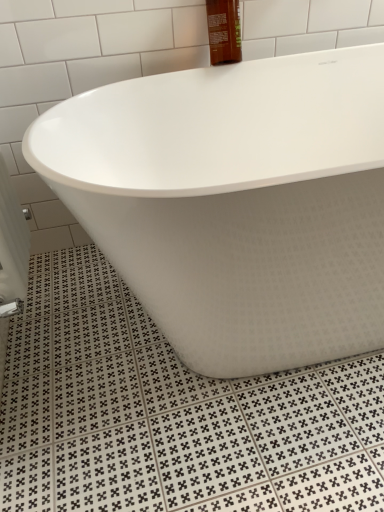
Question: From a real-world perspective, is white matte bathtub at center physically located above or below brown glass bottle at upper center?

Choices:
 (A) above
 (B) below

Answer: (B)

Question: Is point (372, 173) closer or farther from the camera than point (208, 27)?

Choices:
 (A) farther
 (B) closer

Answer: (B)

Question: Would you say white matte bathtub at center is to the left or to the right of brown glass bottle at upper center in the picture?

Choices:
 (A) left
 (B) right

Answer: (B)

Question: Considering the positions of brown glass bottle at upper center and white matte bathtub at center in the image, is brown glass bottle at upper center bigger or smaller than white matte bathtub at center?

Choices:
 (A) big
 (B) small

Answer: (B)

Question: From the image's perspective, is brown glass bottle at upper center above or below white matte bathtub at center?

Choices:
 (A) above
 (B) below

Answer: (A)

Question: Considering the positions of brown glass bottle at upper center and white matte bathtub at center in the image, is brown glass bottle at upper center taller or shorter than white matte bathtub at center?

Choices:
 (A) short
 (B) tall

Answer: (A)

Question: Considering the relative positions of brown glass bottle at upper center and white matte bathtub at center in the image provided, is brown glass bottle at upper center to the left or to the right of white matte bathtub at center?

Choices:
 (A) right
 (B) left

Answer: (B)